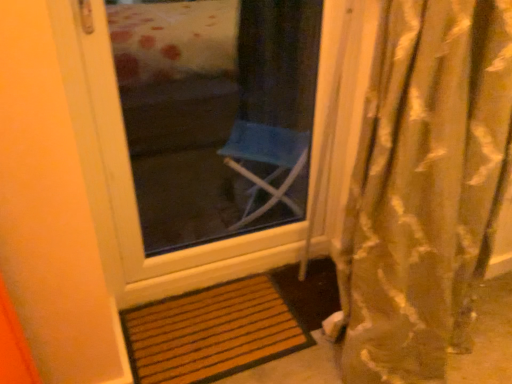
Where is `gold silky curtain at right`? gold silky curtain at right is located at coordinates (425, 187).

What do you see at coordinates (425, 187) in the screenshot? I see `gold silky curtain at right` at bounding box center [425, 187].

What is the approximate width of gold silky curtain at right?

gold silky curtain at right is 12.47 inches wide.

Locate an element on the screen. The width and height of the screenshot is (512, 384). gold silky curtain at right is located at coordinates (425, 187).